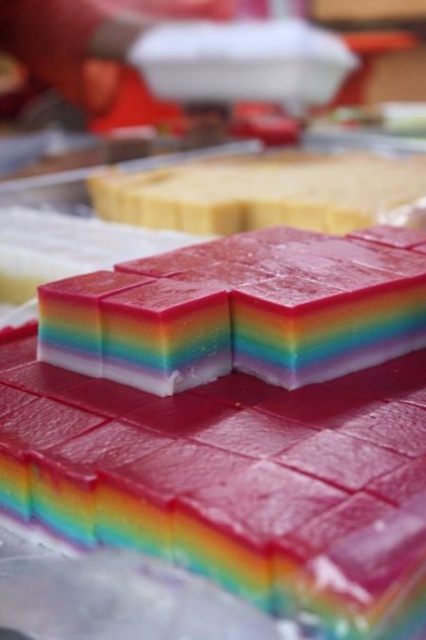
Is rainbow gelatin cube at center positioned at the back of rainbow gelatin at center?

No, rainbow gelatin cube at center is closer to the viewer.

In the scene shown: Is rainbow gelatin cube at center wider than rainbow gelatin at center?

Indeed, rainbow gelatin cube at center has a greater width compared to rainbow gelatin at center.

Describe the element at coordinates (239, 420) in the screenshot. This screenshot has height=640, width=426. I see `rainbow gelatin cube at center` at that location.

Where is `rainbow gelatin cube at center`? The width and height of the screenshot is (426, 640). rainbow gelatin cube at center is located at coordinates (239, 420).